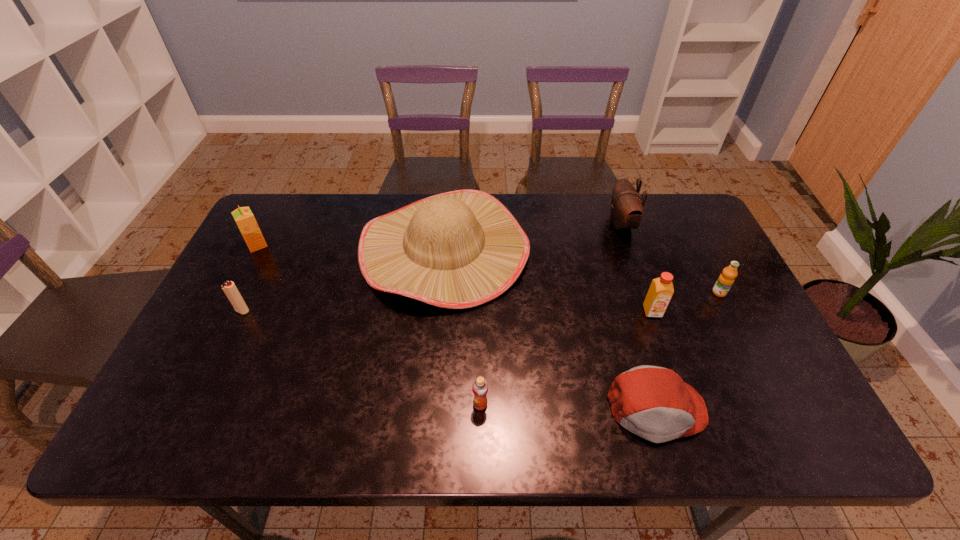
You are a GUI agent. You are given a task and a screenshot of the screen. Output one action in this format:
    pyautogui.click(x=<x>, y=<y>)
    Task: Click on the sunhat
    The height and width of the screenshot is (540, 960).
    Given the screenshot: What is the action you would take?
    pyautogui.click(x=460, y=249)

Identify the location of pouch. (626, 211).

This screenshot has width=960, height=540. Identify the location of the leftmost orange juice. (243, 216).

Locate an element on the screen. The image size is (960, 540). the second orange juice from right to left is located at coordinates (661, 289).

Where is `the third nearest orange juice`? This screenshot has width=960, height=540. the third nearest orange juice is located at coordinates (726, 279).

The width and height of the screenshot is (960, 540). I want to click on the rightmost object, so click(726, 279).

What are the coordinates of `igniter` in the screenshot? It's located at (229, 288).

You are a GUI agent. You are given a task and a screenshot of the screen. Output one action in this format:
    pyautogui.click(x=<x>, y=<y>)
    Task: Click on the second orange juice from left to right
    The width and height of the screenshot is (960, 540).
    Given the screenshot: What is the action you would take?
    pyautogui.click(x=480, y=386)

Locate an element on the screen. cap is located at coordinates (652, 402).

You are a GUI agent. You are given a task and a screenshot of the screen. Output one action in this format:
    pyautogui.click(x=<x>, y=<y>)
    Task: Click on the free location located 0.370m on the right of the sunhat
    The height and width of the screenshot is (540, 960).
    Given the screenshot: What is the action you would take?
    pyautogui.click(x=649, y=248)